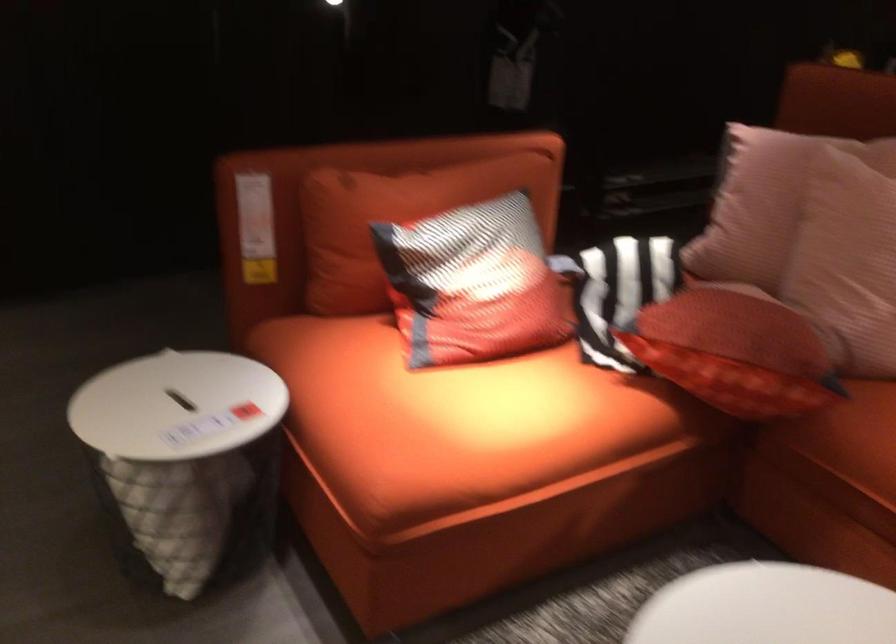
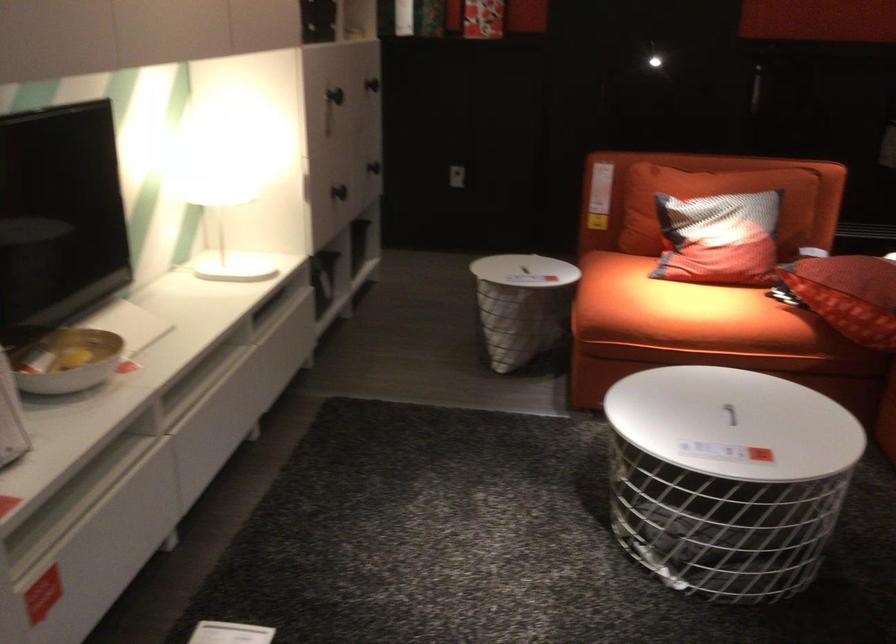
The point at (169,406) is marked in the first image. Where is the corresponding point in the second image?

(522, 270)